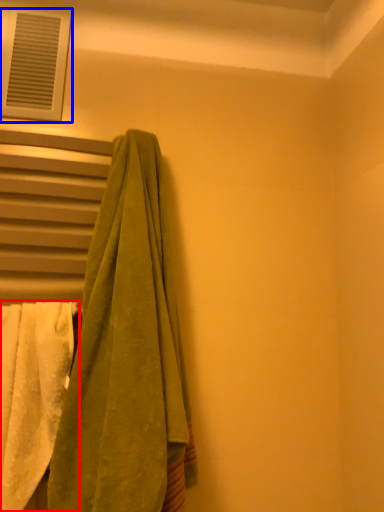
Question: Which point is closer to the camera, towel (highlighted by a red box) or window (highlighted by a blue box)?

Choices:
 (A) towel
 (B) window

Answer: (A)